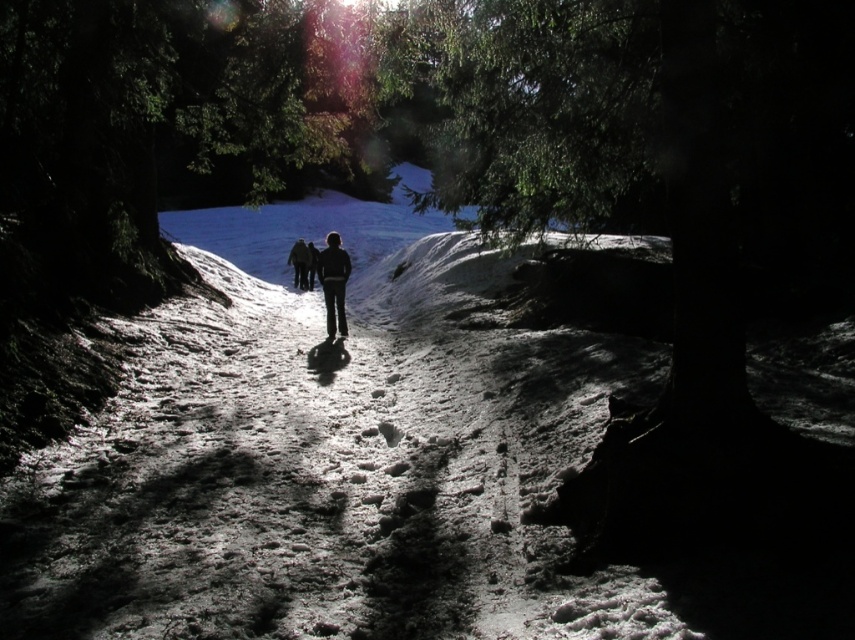
Does black matte skier at center appear under black matte jacket at center?

Indeed, black matte skier at center is positioned under black matte jacket at center.

Is black matte skier at center bigger than black matte jacket at center?

No, black matte skier at center is not bigger than black matte jacket at center.

What are the coordinates of `black matte skier at center` in the screenshot? It's located at (333, 284).

You are a GUI agent. You are given a task and a screenshot of the screen. Output one action in this format:
    pyautogui.click(x=<x>, y=<y>)
    Task: Click on the black matte skier at center
    The width and height of the screenshot is (855, 640).
    Given the screenshot: What is the action you would take?
    pyautogui.click(x=333, y=284)